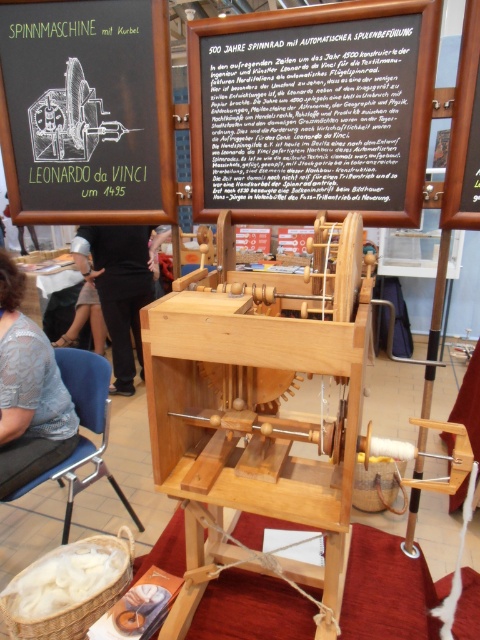
Describe the element at coordinates (86, 109) in the screenshot. I see `black chalkboard at upper left` at that location.

Can you confirm if black chalkboard at upper left is positioned below green chalkboard at upper left?

No, black chalkboard at upper left is not below green chalkboard at upper left.

Is point (153, 154) in front of point (84, 177)?

Yes, it is.

You are a GUI agent. You are given a task and a screenshot of the screen. Output one action in this format:
    pyautogui.click(x=<x>, y=<y>)
    Task: Click on the black chalkboard at upper left
    The width and height of the screenshot is (480, 640).
    Given the screenshot: What is the action you would take?
    pyautogui.click(x=86, y=109)

Is black chalkboard at upper left shorter than wooden frame at center?

Incorrect, black chalkboard at upper left's height does not fall short of wooden frame at center's.

Is point (127, 170) more distant than point (457, 140)?

Yes, point (127, 170) is behind point (457, 140).

Is point (168, 125) positioned in front of point (477, 152)?

No, (168, 125) is further to viewer.

You are a GUI agent. You are given a task and a screenshot of the screen. Output one action in this format:
    pyautogui.click(x=<x>, y=<y>)
    Task: Click on the black chalkboard at upper left
    
    Given the screenshot: What is the action you would take?
    pyautogui.click(x=86, y=109)

Does black fabric at center have a greater height compared to wooden frame at center?

Correct, black fabric at center is much taller as wooden frame at center.

Image resolution: width=480 pixels, height=640 pixels. What do you see at coordinates (120, 285) in the screenshot?
I see `black fabric at center` at bounding box center [120, 285].

Where is `black fabric at center`? black fabric at center is located at coordinates (120, 285).